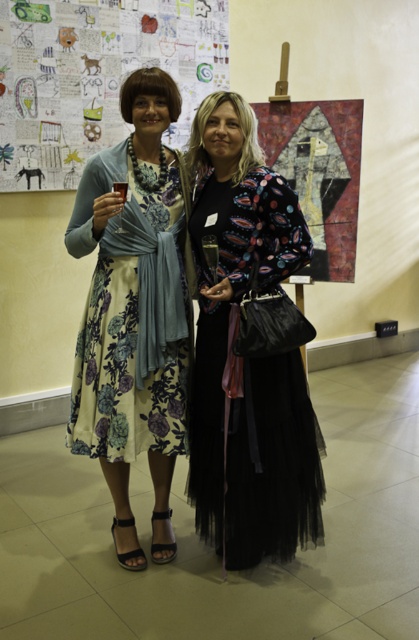
Does black tulle dress at center have a smaller size compared to floral silk dress at center?

Actually, black tulle dress at center might be larger than floral silk dress at center.

Is black tulle dress at center above floral silk dress at center?

Incorrect, black tulle dress at center is not positioned above floral silk dress at center.

Who is more forward, (219, 442) or (126, 419)?

Point (126, 419)

At what (x,y) coordinates should I click in order to perform the action: click on black tulle dress at center. Please return your answer as a coordinate pair (x, y). The width and height of the screenshot is (419, 640). Looking at the image, I should click on (230, 307).

Which is in front, point (132, 16) or point (150, 228)?

Positioned in front is point (150, 228).

Can you confirm if colored paper collage at upper left is wider than floral silk dress at center?

Yes, colored paper collage at upper left is wider than floral silk dress at center.

Is point (198, 48) closer to viewer compared to point (113, 364)?

No, (198, 48) is further to viewer.

The image size is (419, 640). I want to click on colored paper collage at upper left, so click(95, 76).

Can you confirm if black tulle dress at center is smaller than colored paper collage at upper left?

Yes, black tulle dress at center is smaller than colored paper collage at upper left.

Which is in front, point (258, 561) or point (38, 118)?

Positioned in front is point (258, 561).

You are a GUI agent. You are given a task and a screenshot of the screen. Output one action in this format:
    pyautogui.click(x=<x>, y=<y>)
    Task: Click on the black tulle dress at center
    This screenshot has height=640, width=419.
    Given the screenshot: What is the action you would take?
    pyautogui.click(x=230, y=307)